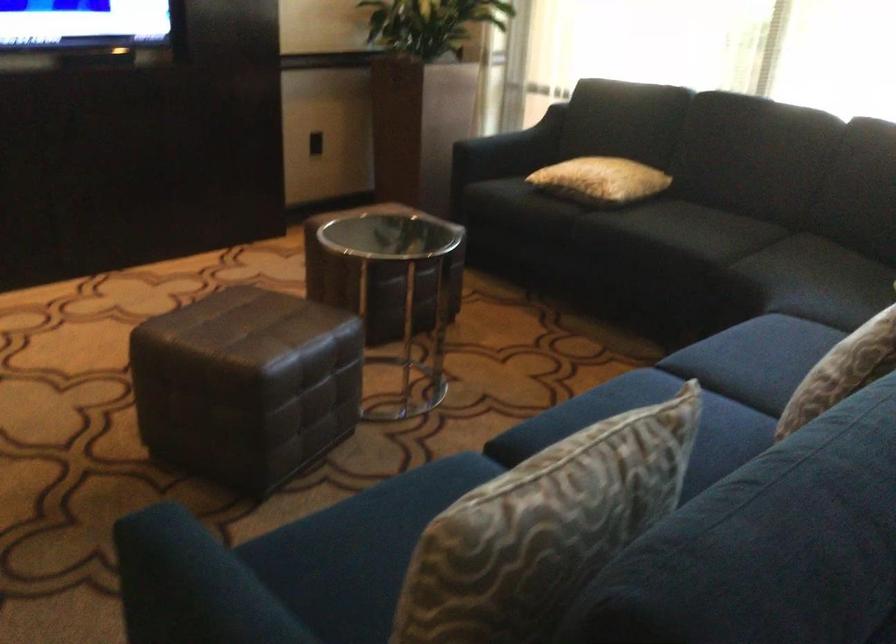
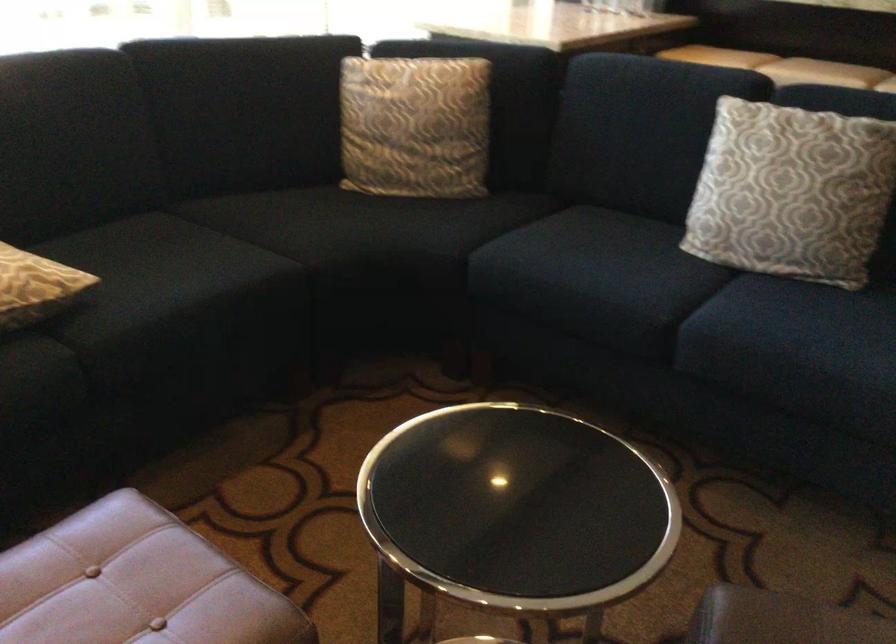
Locate, in the second image, the point that corresponds to (742,346) in the first image.

(590, 274)